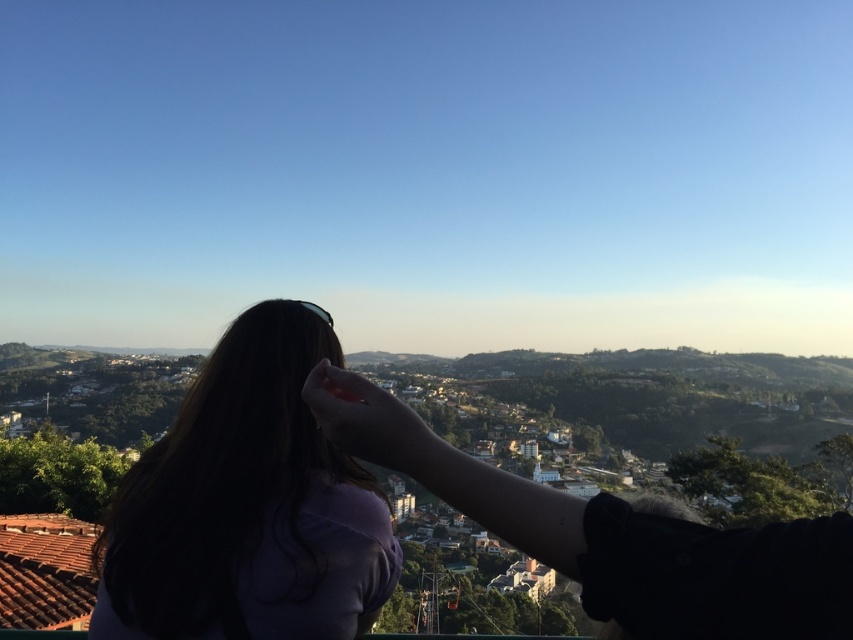
Does dark purple shirt at center have a larger size compared to matte pink hand at center?

Yes, dark purple shirt at center is bigger than matte pink hand at center.

Which is behind, point (254, 337) or point (312, 396)?

The point (254, 337) is more distant.

This screenshot has width=853, height=640. What are the coordinates of `dark purple shirt at center` in the screenshot? It's located at (247, 506).